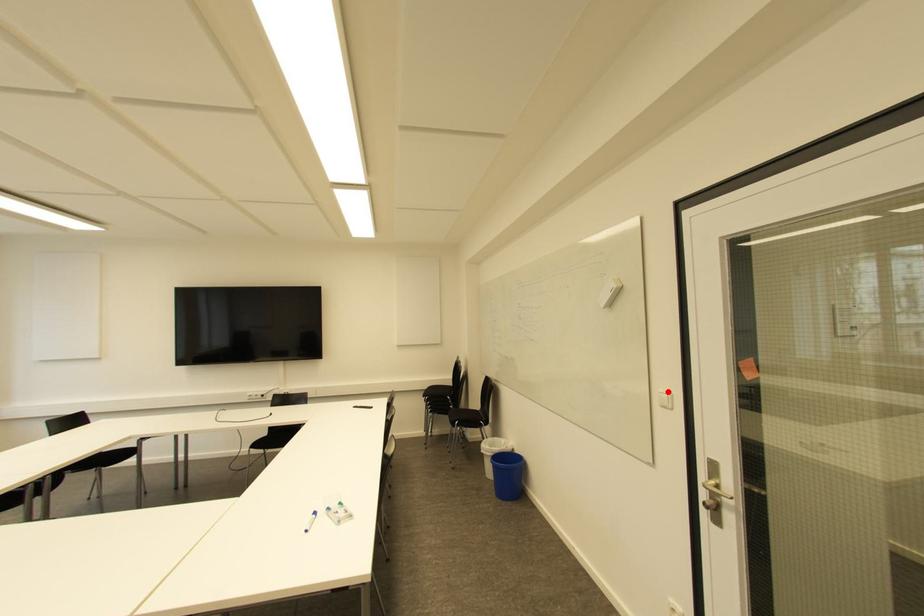
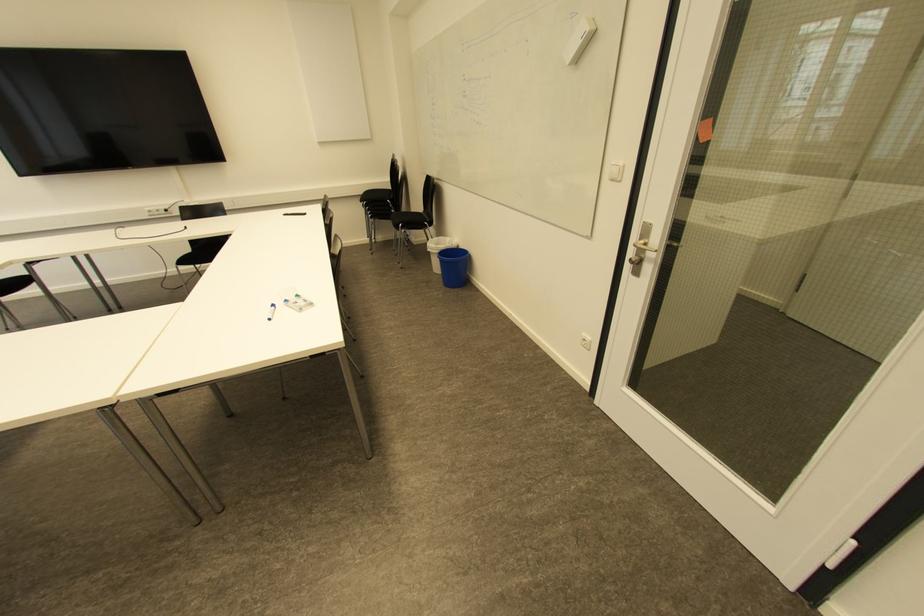
Find the pixel in the second image that matches the highlighted location in the first image.

(621, 163)